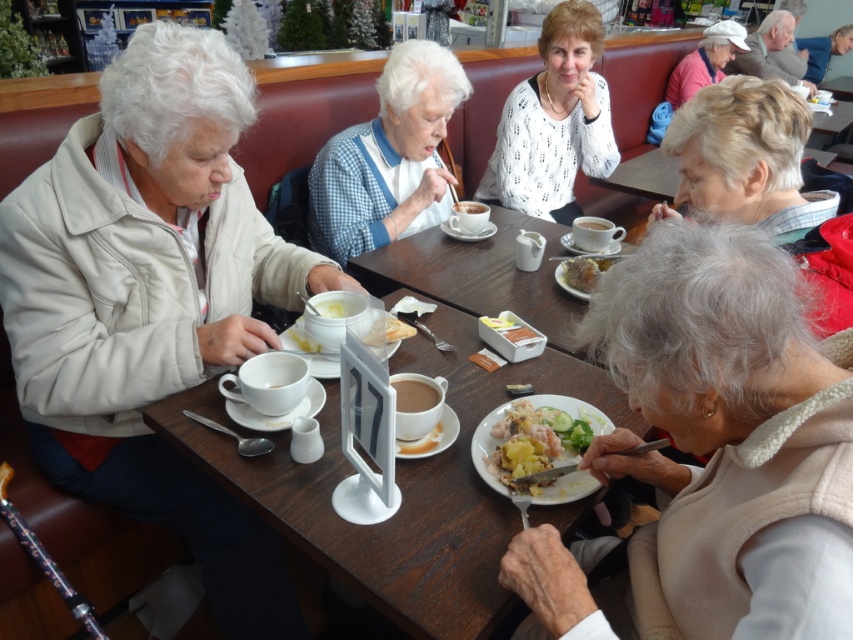
Question: Which of the following is the farthest from the observer?

Choices:
 (A) white dotted sweater at center
 (B) white checkered shirt at center

Answer: (A)

Question: Does white glossy table at center appear under crumbly bread at center?

Choices:
 (A) no
 (B) yes

Answer: (B)

Question: Which point is farther to the camera?

Choices:
 (A) white glossy table at center
 (B) white ceramic table at center

Answer: (B)

Question: Can you confirm if white woolen vest at lower right is thinner than white dotted sweater at center?

Choices:
 (A) no
 (B) yes

Answer: (B)

Question: From the image, what is the correct spatial relationship of white matte jacket at left in relation to shiny plastic fork at lower center?

Choices:
 (A) below
 (B) above

Answer: (B)

Question: Considering the real-world distances, which object is farthest from the white woolen vest at lower right?

Choices:
 (A) white glossy table at center
 (B) matte ceramic cup at center
 (C) white dotted sweater at center

Answer: (C)